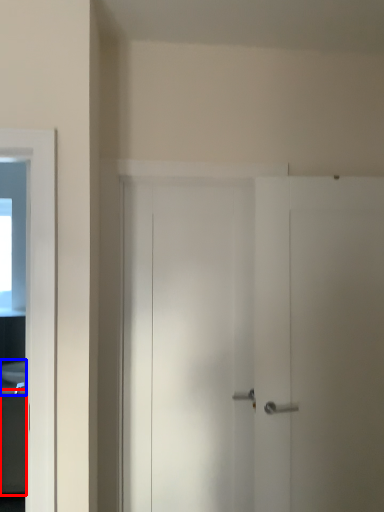
Question: Which point is closer to the camera, cabinetry (highlighted by a red box) or sink (highlighted by a blue box)?

Choices:
 (A) cabinetry
 (B) sink

Answer: (A)